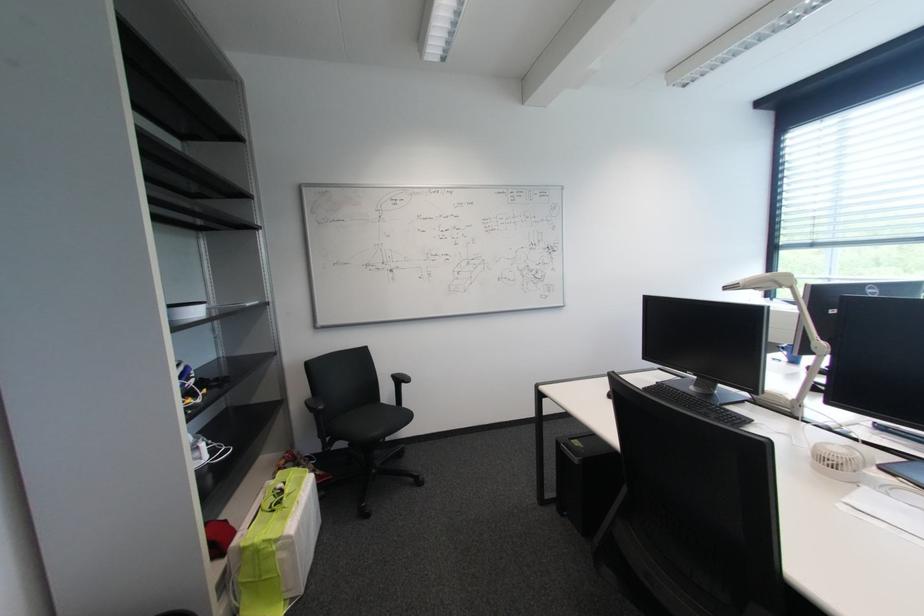
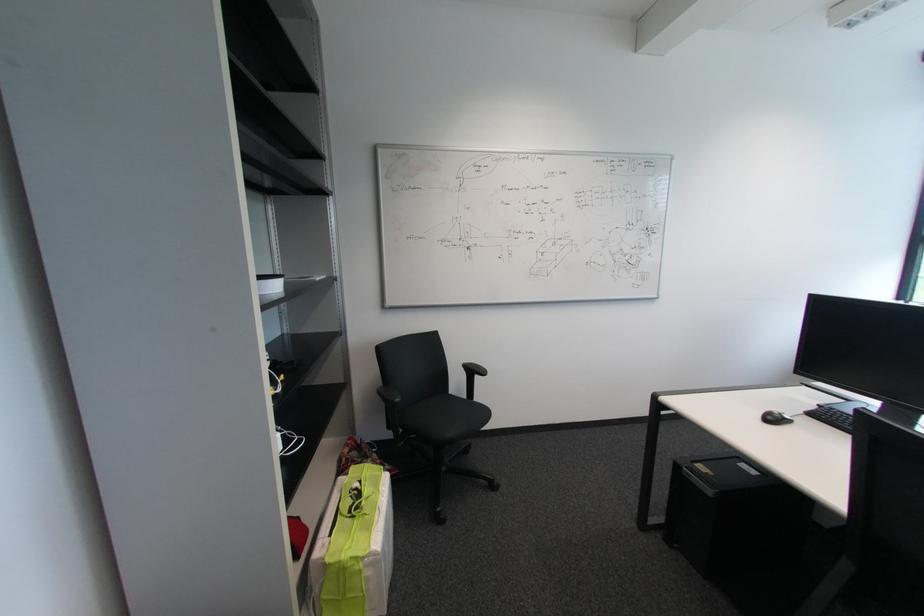
Locate, in the second image, the point that corresponds to pixel 400 406 in the first image.

(471, 399)